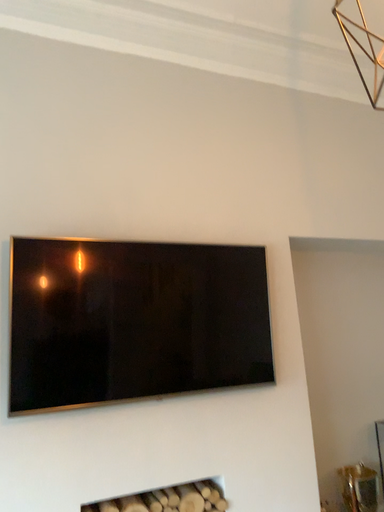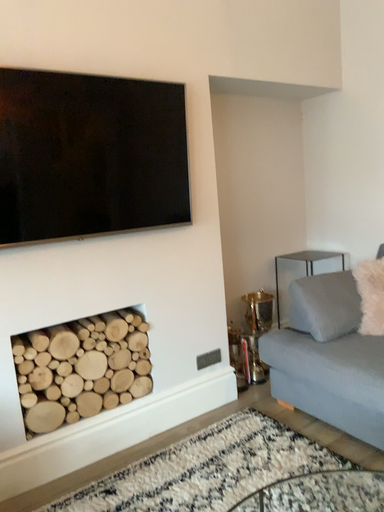
Question: How did the camera likely rotate when shooting the video?

Choices:
 (A) rotated right
 (B) rotated left

Answer: (A)